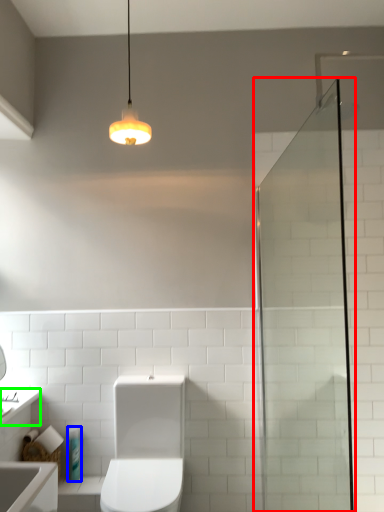
Question: Which object is positioned farthest from screen door (highlighted by a red box)? Select from toiletry (highlighted by a blue box) and counter top (highlighted by a green box).

Choices:
 (A) toiletry
 (B) counter top

Answer: (B)